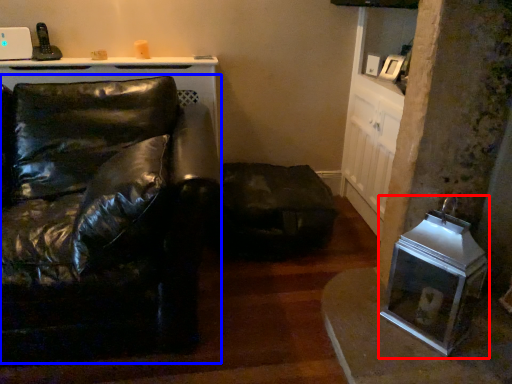
Question: Which of the following is the farthest to the observer, appliance (highlighted by a red box) or studio couch (highlighted by a blue box)?

Choices:
 (A) appliance
 (B) studio couch

Answer: (A)